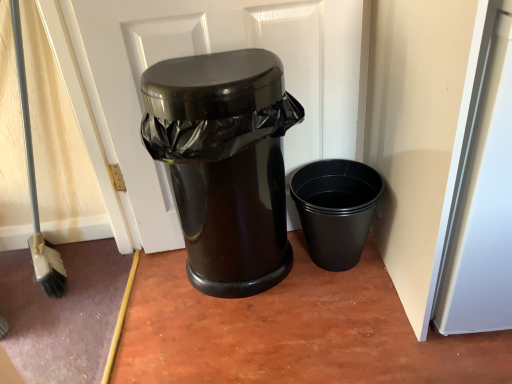
Question: Does black matte plastic cup at right, placed as the 1th waste container when sorted from right to left, have a greater width compared to glossy black trash can at center, which is the 1th waste container in left-to-right order?

Choices:
 (A) no
 (B) yes

Answer: (B)

Question: Does black matte plastic cup at right, positioned as the second waste container in left-to-right order, have a lesser height compared to glossy black trash can at center, which ranks as the 2th waste container in right-to-left order?

Choices:
 (A) no
 (B) yes

Answer: (B)

Question: Are black matte plastic cup at right, placed as the 1th waste container when sorted from right to left, and glossy black trash can at center, which ranks as the 2th waste container in right-to-left order, far apart?

Choices:
 (A) yes
 (B) no

Answer: (B)

Question: Can you confirm if black matte plastic cup at right, positioned as the second waste container in left-to-right order, is taller than glossy black trash can at center, which ranks as the 2th waste container in right-to-left order?

Choices:
 (A) yes
 (B) no

Answer: (B)

Question: Is glossy black trash can at center, which ranks as the 2th waste container in right-to-left order, at the back of black matte plastic cup at right, placed as the 1th waste container when sorted from right to left?

Choices:
 (A) no
 (B) yes

Answer: (A)

Question: From the image's perspective, is black matte plastic cup at right, placed as the 1th waste container when sorted from right to left, on top of glossy black trash can at center, which ranks as the 2th waste container in right-to-left order?

Choices:
 (A) yes
 (B) no

Answer: (B)

Question: From a real-world perspective, is glossy black trash can at center positioned under glossy black trash can at center, which is the 1th waste container in left-to-right order, based on gravity?

Choices:
 (A) no
 (B) yes

Answer: (A)

Question: Does glossy black trash can at center lie in front of glossy black trash can at center, which is the 1th waste container in left-to-right order?

Choices:
 (A) yes
 (B) no

Answer: (B)

Question: Is glossy black trash can at center positioned beyond the bounds of glossy black trash can at center, which ranks as the 2th waste container in right-to-left order?

Choices:
 (A) no
 (B) yes

Answer: (A)

Question: Does glossy black trash can at center appear on the right side of glossy black trash can at center, which is the 1th waste container in left-to-right order?

Choices:
 (A) yes
 (B) no

Answer: (A)

Question: Is glossy black trash can at center oriented towards glossy black trash can at center, which is the 1th waste container in left-to-right order?

Choices:
 (A) no
 (B) yes

Answer: (B)

Question: Would you say glossy black trash can at center is a long distance from glossy black trash can at center, which ranks as the 2th waste container in right-to-left order?

Choices:
 (A) no
 (B) yes

Answer: (A)

Question: From the image's perspective, is black matte plastic cup at right, positioned as the second waste container in left-to-right order, located above glossy black trash can at center?

Choices:
 (A) yes
 (B) no

Answer: (B)